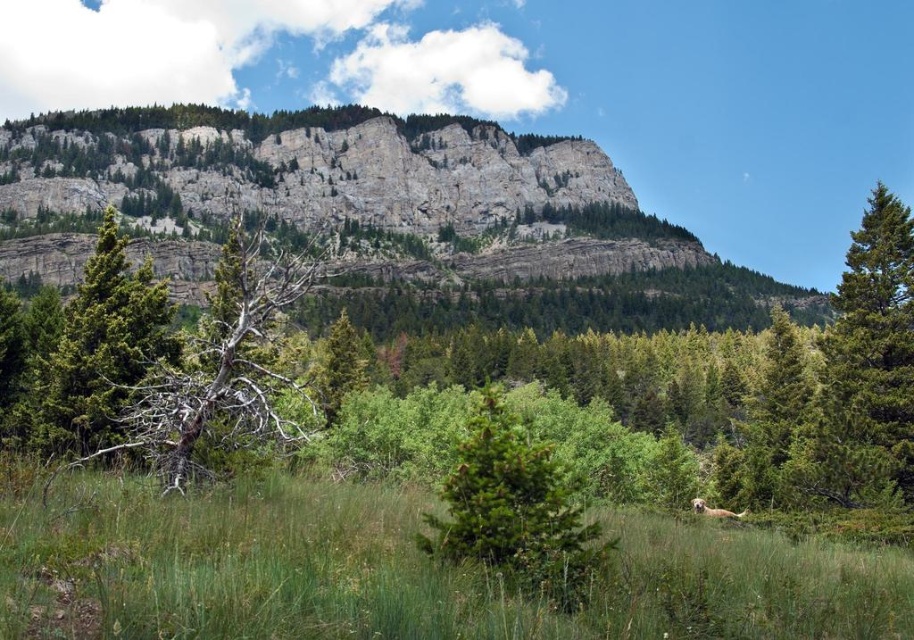
You are standing at the point marked by the coordinates point (865, 368) in the image. Looking around, you see a green matte tree at right. Which direction should you face to see the green matte tree at right?

You should face to the right direction to see the green matte tree at right since the point (865, 368) is marked as the location of the green matte tree at right.